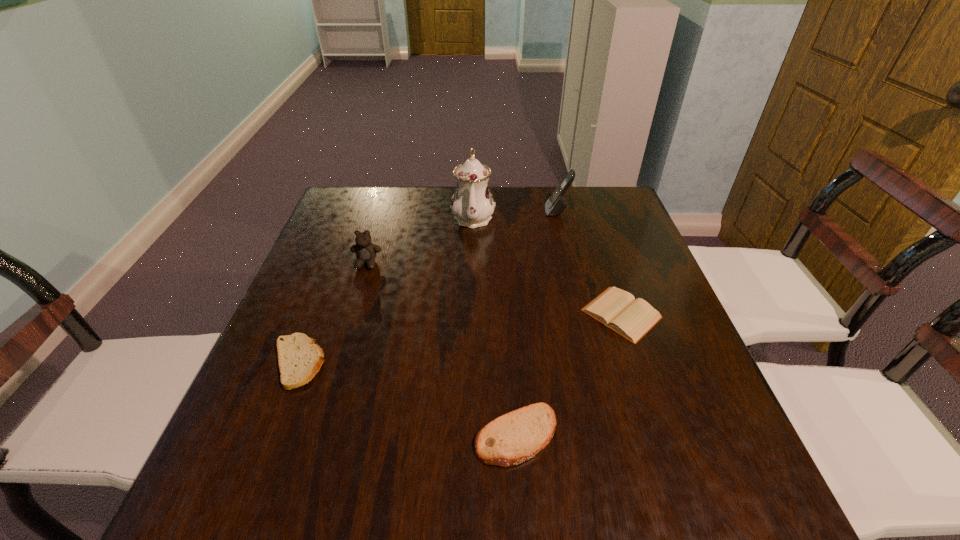
You are a GUI agent. You are given a task and a screenshot of the screen. Output one action in this format:
    pyautogui.click(x=<x>, y=<y>)
    Task: Click on the pita bread present at the left edge
    
    Given the screenshot: What is the action you would take?
    pyautogui.click(x=300, y=359)

The width and height of the screenshot is (960, 540). I want to click on object at the right edge, so click(617, 309).

Identify the location of free space at the far edge of the desktop. Image resolution: width=960 pixels, height=540 pixels. (399, 198).

You are a GUI agent. You are given a task and a screenshot of the screen. Output one action in this format:
    pyautogui.click(x=<x>, y=<y>)
    Task: Click on the vacant area at the near edge
    Image resolution: width=960 pixels, height=540 pixels.
    Given the screenshot: What is the action you would take?
    pyautogui.click(x=616, y=498)

You are a GUI agent. You are given a task and a screenshot of the screen. Output one action in this format:
    pyautogui.click(x=<x>, y=<y>)
    Task: Click on the vacant space at the left edge of the desktop
    
    Given the screenshot: What is the action you would take?
    pyautogui.click(x=321, y=318)

Locate an element on the screen. This screenshot has height=540, width=960. vacant space at the right edge is located at coordinates (620, 271).

This screenshot has height=540, width=960. What are the coordinates of `vacant space at the far left corner of the desktop` in the screenshot? It's located at (339, 195).

What are the coordinates of `free space at the far right corner of the desktop` in the screenshot? It's located at (606, 226).

What are the coordinates of `free space between the taller pita bread and the diary` in the screenshot? It's located at (569, 375).

Identify the location of free spot between the tallest object and the taller pita bread. The width and height of the screenshot is (960, 540). (494, 326).